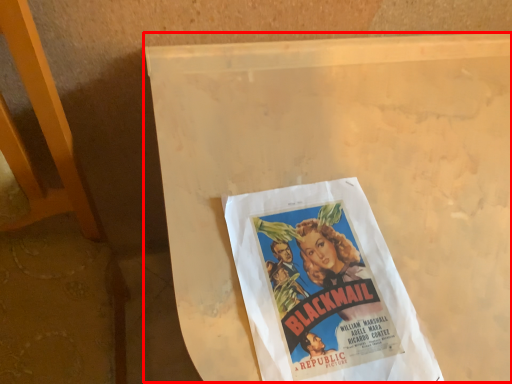
Question: From the image's perspective, where is table (annotated by the red box) located in relation to poster in the image?

Choices:
 (A) below
 (B) above

Answer: (A)